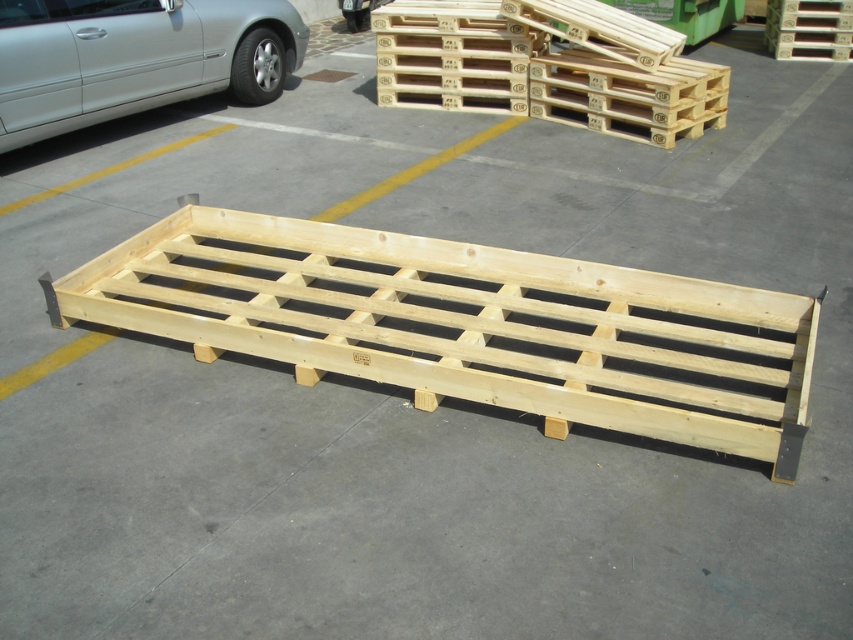
You are standing in the parking lot and want to determine which of the two points, point [242,288] or point [787,58], is closer to you. Based on the scene, which point is nearer?

Point [242,288] is closer to the camera than point [787,58], so it is the nearer point.

From the picture: You are a delivery driver who needs to park your silver metallic car at left in a parking spot that is the same size as the natural wood pallet at center. Can your car fit into the parking spot?

The natural wood pallet at center is wider than the silver metallic car at left, so the car should fit into the parking spot since the pallet is wider.